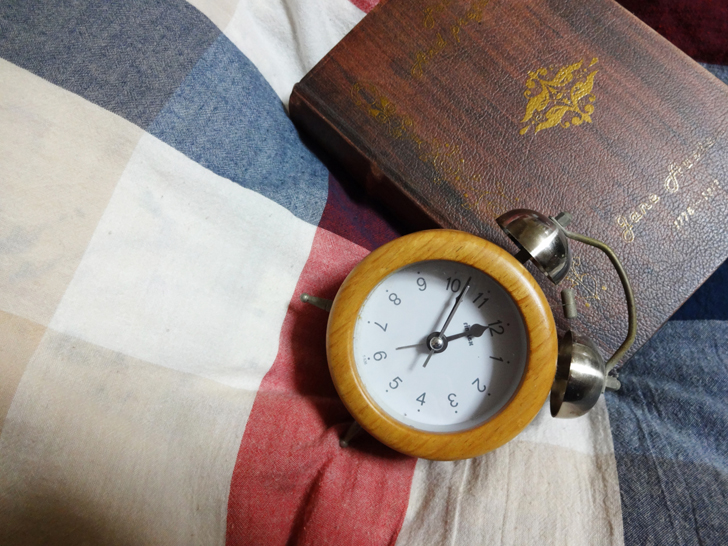
Locate an element on the screen. This screenshot has height=546, width=728. clock hour hand is located at coordinates (470, 329).